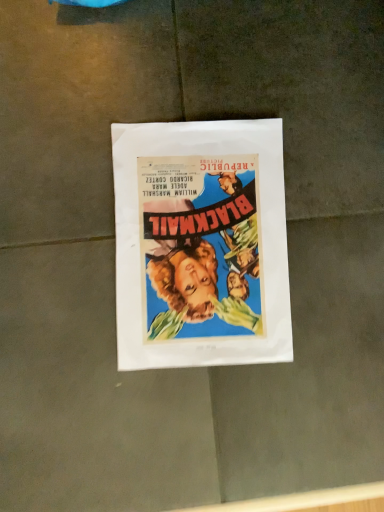
This screenshot has height=512, width=384. What do you see at coordinates (201, 244) in the screenshot?
I see `matte paper poster at center` at bounding box center [201, 244].

Identify the location of matte paper poster at center. (201, 244).

Measure the distance between point (x=232, y=140) and camera.

Point (x=232, y=140) and camera are 20.75 inches apart.

I want to click on matte paper poster at center, so click(201, 244).